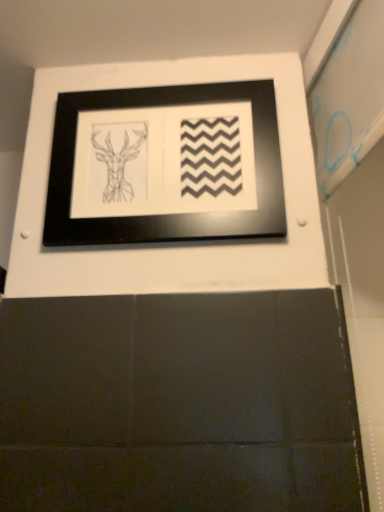
Image resolution: width=384 pixels, height=512 pixels. What do you see at coordinates (156, 216) in the screenshot? I see `black matte picture frame at upper center` at bounding box center [156, 216].

Measure the distance between black matte picture frame at upper center and camera.

They are 25.02 inches apart.

In the scene shown: What is the approximate width of black matte picture frame at upper center?

The width of black matte picture frame at upper center is 0.84 inches.

Image resolution: width=384 pixels, height=512 pixels. Find the location of `black matte picture frame at upper center`. black matte picture frame at upper center is located at coordinates (156, 216).

I want to click on black matte picture frame at upper center, so click(156, 216).